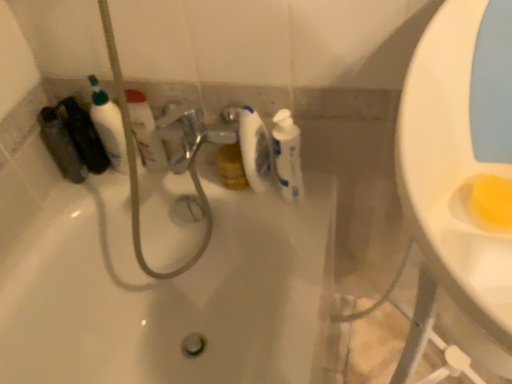
Question: Considering the positions of white glossy bottle at center, the second cleaning product from the left, and white glossy bottle at upper left, which ranks as the second cleaning product in right-to-left order, in the image, is white glossy bottle at center, the second cleaning product from the left, taller or shorter than white glossy bottle at upper left, which ranks as the second cleaning product in right-to-left order,?

Choices:
 (A) tall
 (B) short

Answer: (A)

Question: In terms of size, does white glossy bottle at center, the second cleaning product from the left, appear bigger or smaller than white glossy bottle at upper left, arranged as the 1th cleaning product when viewed from the left?

Choices:
 (A) small
 (B) big

Answer: (B)

Question: Estimate the real-world distances between objects in this image. Which object is farther from the white glossy bathtub at center?

Choices:
 (A) white glossy bottle at center, marked as the first cleaning product in a right-to-left arrangement
 (B) white glossy bottle at upper left, which ranks as the second cleaning product in right-to-left order
 (C) translucent plastic mouthwash at left
 (D) white glossy toilet paper at center

Answer: (C)

Question: Which object is the farthest from the white glossy bottle at upper left, which ranks as the second cleaning product in right-to-left order?

Choices:
 (A) white glossy bathtub at center
 (B) white glossy toilet paper at center
 (C) white glossy bottle at center, marked as the first cleaning product in a right-to-left arrangement
 (D) translucent plastic mouthwash at left

Answer: (A)